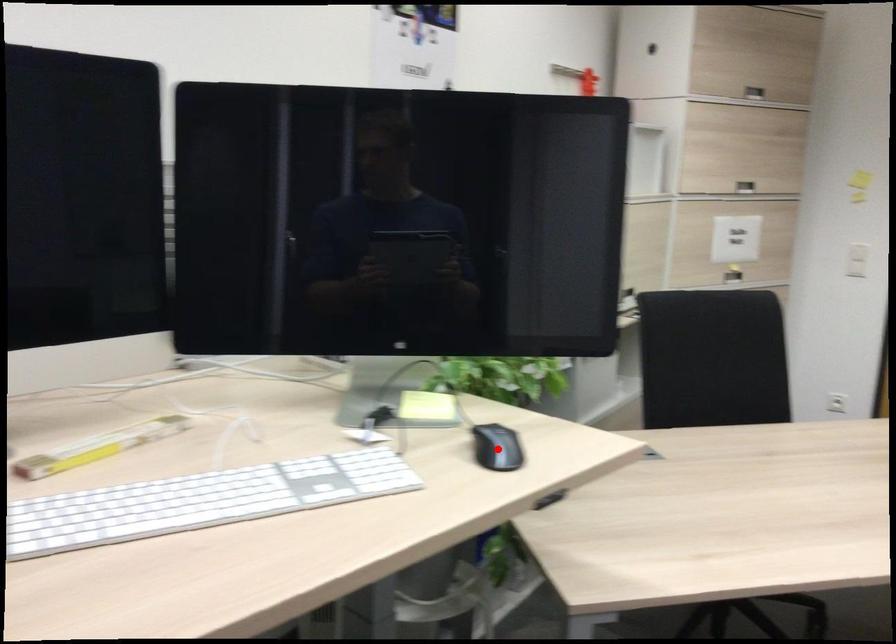
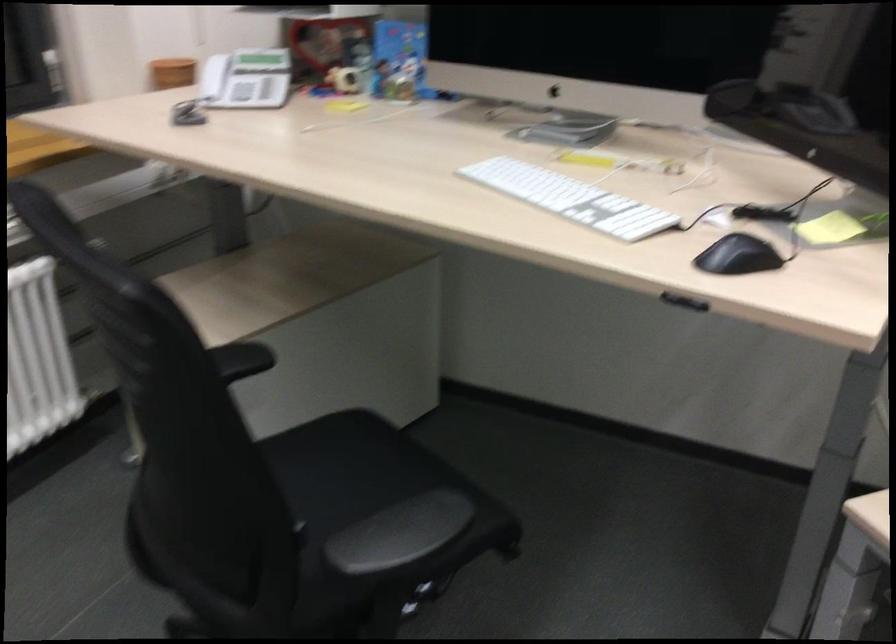
In the second image, find the point that corresponds to the highlighted location in the first image.

(737, 256)